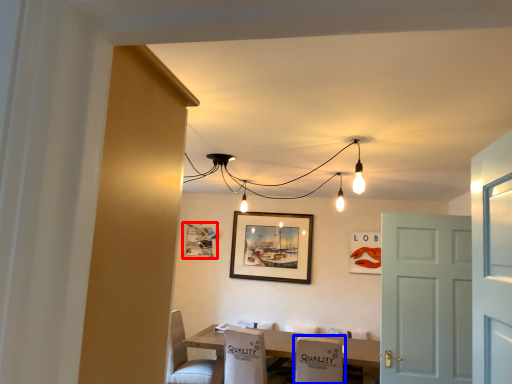
Question: Which point is closer to the camera, picture frame (highlighted by a red box) or armchair (highlighted by a blue box)?

Choices:
 (A) picture frame
 (B) armchair

Answer: (B)